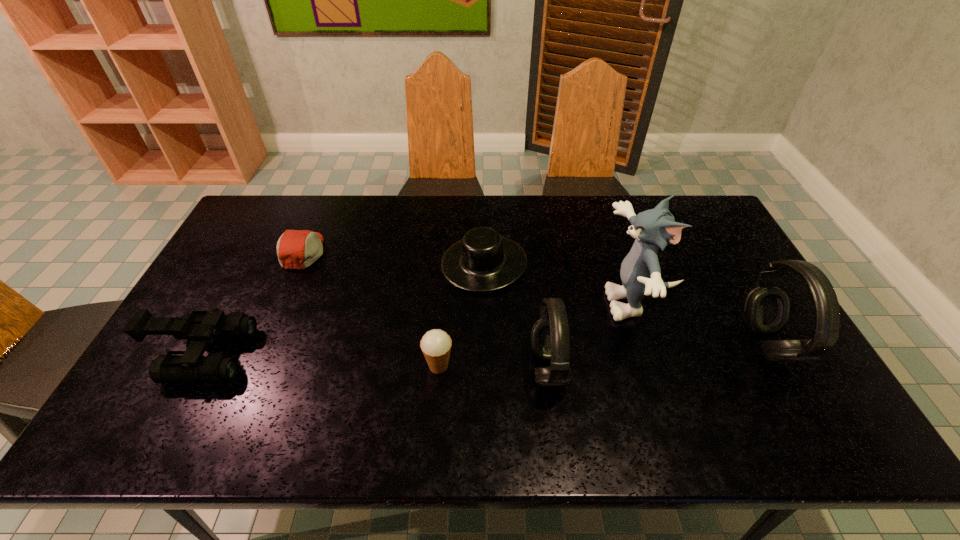
In the image, there is a desktop. Where is `vacant space at the left edge`? vacant space at the left edge is located at coordinates coord(232,286).

Find the location of `vacant space at the far left corner of the desktop`. vacant space at the far left corner of the desktop is located at coordinates (283, 206).

Image resolution: width=960 pixels, height=540 pixels. I want to click on empty location between the icecream and the binoculars, so click(x=321, y=361).

Identify the location of vacant area between the tallest object and the binoculars. This screenshot has height=540, width=960. (421, 329).

Where is `free spot between the icecream and the cap`? The height and width of the screenshot is (540, 960). free spot between the icecream and the cap is located at coordinates (371, 309).

You are a GUI agent. You are given a task and a screenshot of the screen. Output one action in this format:
    pyautogui.click(x=<x>, y=<y>)
    Task: Click on the vacant region between the icecream and the dress hat
    
    Given the screenshot: What is the action you would take?
    coord(461,315)

Find the location of a particular element. Image resolution: width=960 pixels, height=540 pixels. empty space between the third tallest object and the sixth shortest object is located at coordinates click(x=658, y=356).

At what (x,y) coordinates should I click in order to perform the action: click on empty space that is in between the third tallest object and the sixth object from left to right. Please return your answer as a coordinate pair (x, y). Looking at the image, I should click on (594, 336).

The width and height of the screenshot is (960, 540). In order to click on vacant area that lies between the second shortest object and the icecream in this screenshot , I will do `click(461, 315)`.

What are the coordinates of `unoccupied area between the tallest object and the dress hat` in the screenshot? It's located at point(562,284).